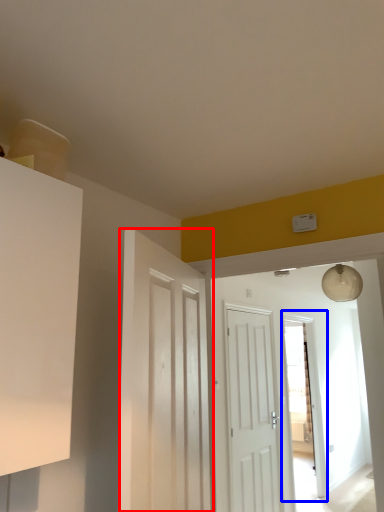
Question: Which object is further to the camera taking this photo, door (highlighted by a red box) or glass door (highlighted by a blue box)?

Choices:
 (A) door
 (B) glass door

Answer: (B)